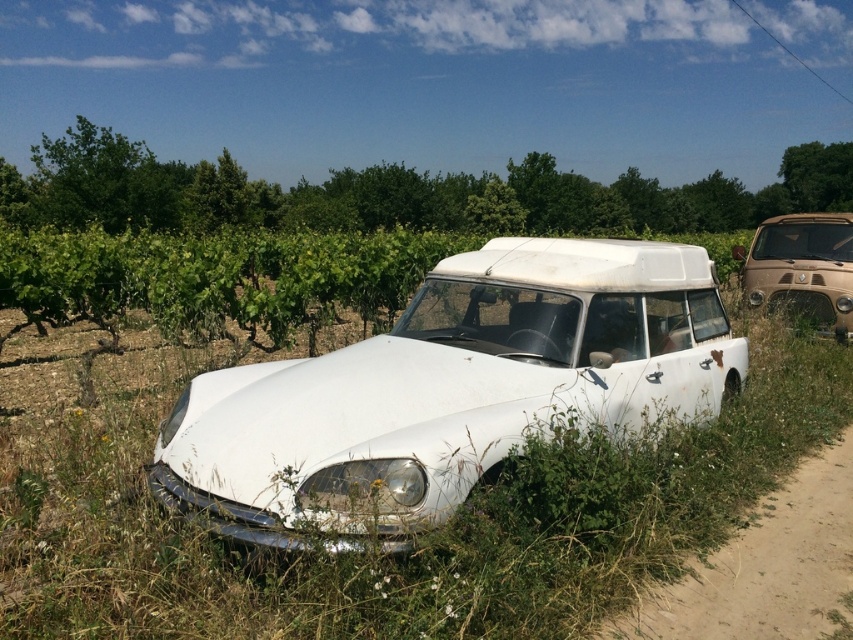
Question: Among these objects, which one is farthest from the camera?

Choices:
 (A) white matte car at center
 (B) dirt track at lower right
 (C) brown matte van at right

Answer: (C)

Question: Estimate the real-world distances between objects in this image. Which object is closer to the white matte car at center?

Choices:
 (A) brown matte van at right
 (B) dirt track at lower right

Answer: (B)

Question: Can you confirm if dirt track at lower right is positioned below brown matte van at right?

Choices:
 (A) yes
 (B) no

Answer: (A)

Question: Is white matte car at center thinner than dirt track at lower right?

Choices:
 (A) no
 (B) yes

Answer: (A)

Question: Can you confirm if white matte car at center is positioned to the right of brown matte van at right?

Choices:
 (A) no
 (B) yes

Answer: (A)

Question: Which of the following is the farthest from the observer?

Choices:
 (A) (548, 381)
 (B) (828, 464)

Answer: (B)